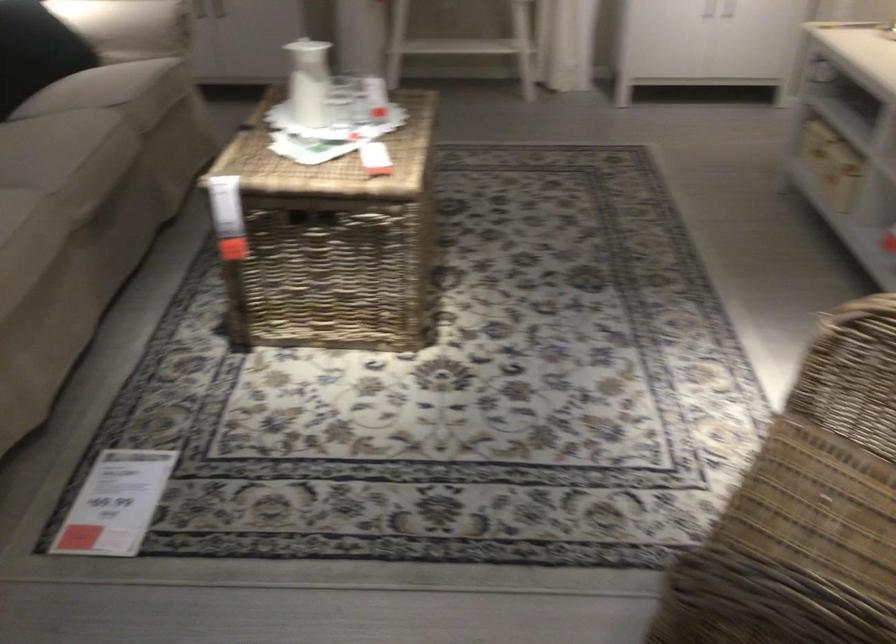
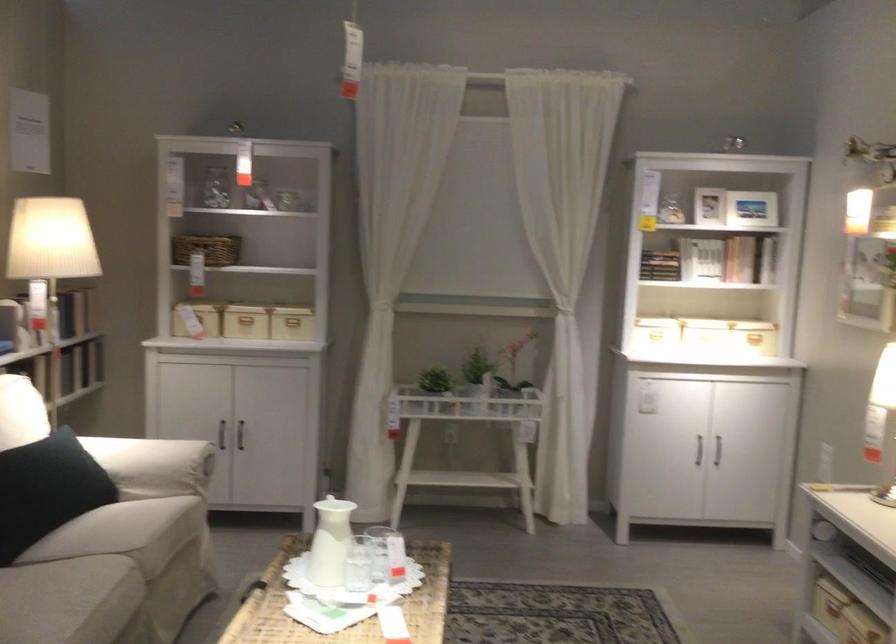
In the second image, find the point that corresponds to (x=339, y=98) in the first image.

(358, 564)